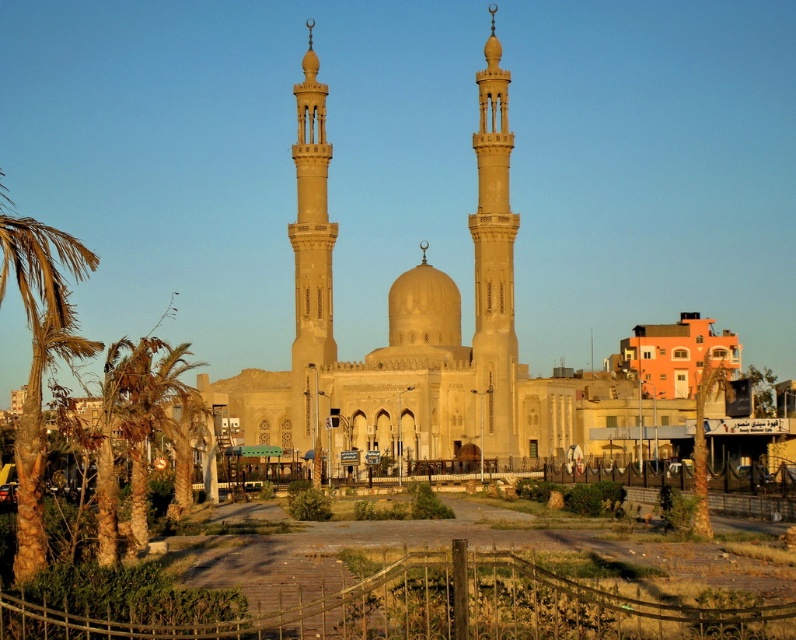
Does point (471, 220) lie behind point (14, 445)?

Yes, it is behind point (14, 445).

Where is `beige stone minaret at center`? beige stone minaret at center is located at coordinates (494, 260).

How distant is beige stone minaret at center from beige stone minaret at center-left?

beige stone minaret at center and beige stone minaret at center-left are 18.24 meters apart.

Is beige stone minaret at center above beige stone minaret at center-left?

Incorrect, beige stone minaret at center is not positioned above beige stone minaret at center-left.

At what (x,y) coordinates should I click in order to perform the action: click on beige stone minaret at center. Please return your answer as a coordinate pair (x, y). The width and height of the screenshot is (796, 640). Looking at the image, I should click on (494, 260).

In order to click on beige stone minaret at center in this screenshot , I will do `click(494, 260)`.

From the picture: Between brown textured palm tree at left and green leafy palm tree at left, which one is positioned higher?

Positioned higher is brown textured palm tree at left.

Between brown textured palm tree at left and green leafy palm tree at left, which one is positioned lower?

green leafy palm tree at left is lower down.

Measure the distance between point (45,344) and camera.

Point (45,344) is 134.22 meters from camera.

You are a GUI agent. You are given a task and a screenshot of the screen. Output one action in this format:
    pyautogui.click(x=<x>, y=<y>)
    Task: Click on the brown textured palm tree at left
    The width and height of the screenshot is (796, 640).
    Given the screenshot: What is the action you would take?
    pyautogui.click(x=38, y=355)